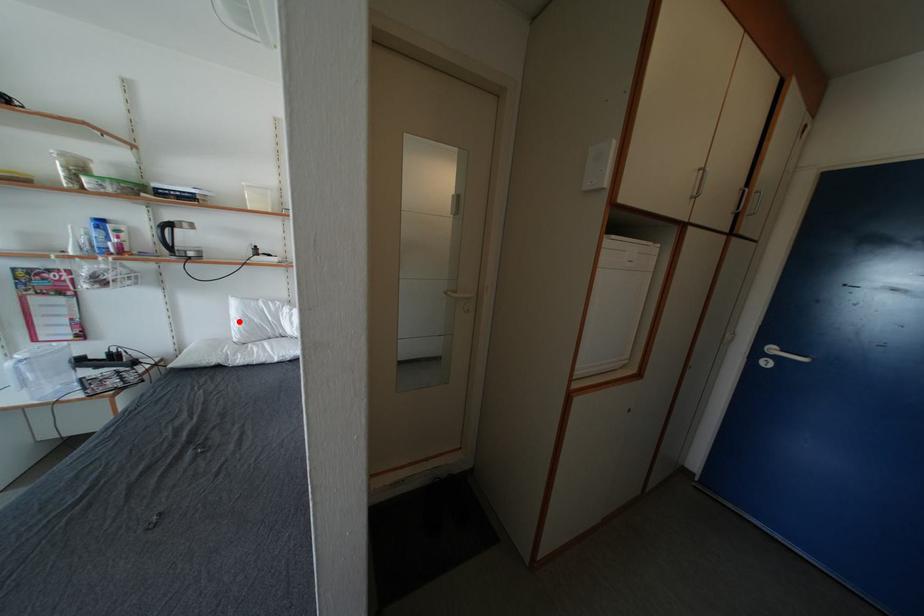
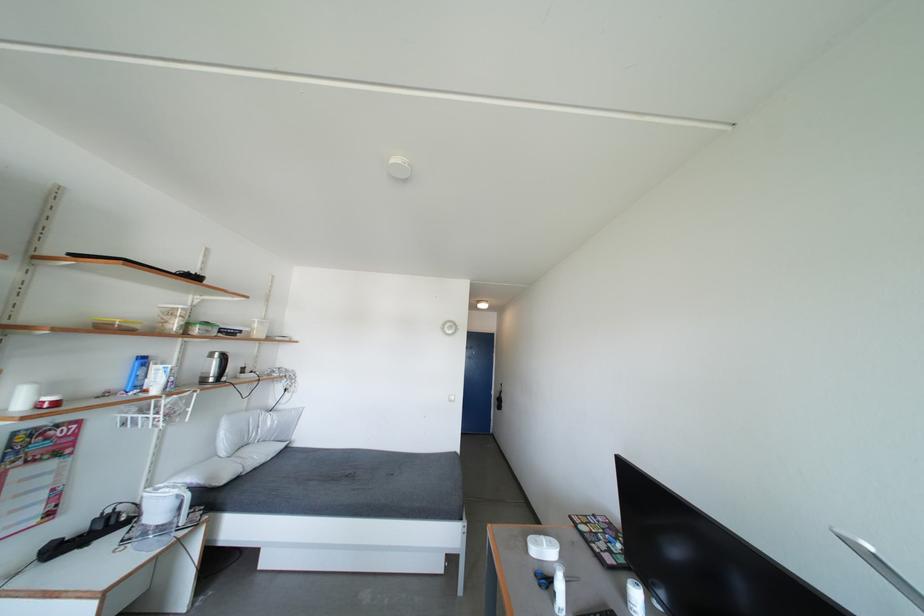
Where in the second image is the point corresponding to the highlighted location from the first image?

(228, 439)